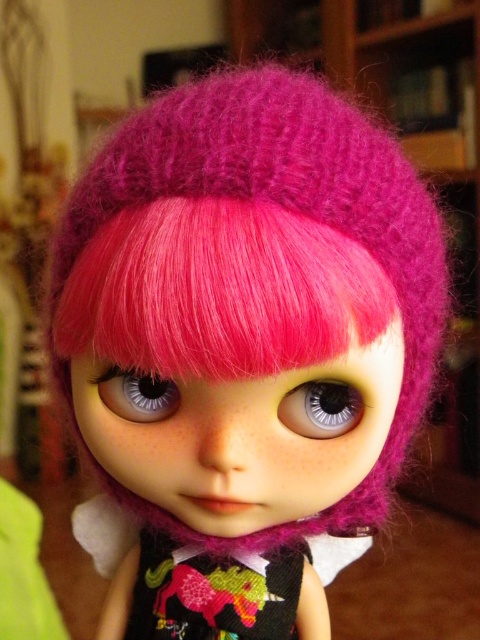
Question: Which object is farther from the camera taking this photo?

Choices:
 (A) satin blue eye at center
 (B) knitted fabric dress at center

Answer: (B)

Question: Which point is closer to the camera?

Choices:
 (A) (357, 422)
 (B) (119, 397)
 (C) (248, 632)

Answer: (A)

Question: Which object appears closest to the camera in this image?

Choices:
 (A) knitted fabric dress at center
 (B) satin silver eye at center

Answer: (B)

Question: Observing the image, what is the correct spatial positioning of knitted fabric dress at center in reference to satin silver eye at center?

Choices:
 (A) below
 (B) above

Answer: (A)

Question: Does knitted fabric dress at center have a greater width compared to satin blue eye at center?

Choices:
 (A) no
 (B) yes

Answer: (B)

Question: Observing the image, what is the correct spatial positioning of knitted fabric dress at center in reference to satin blue eye at center?

Choices:
 (A) right
 (B) left

Answer: (A)